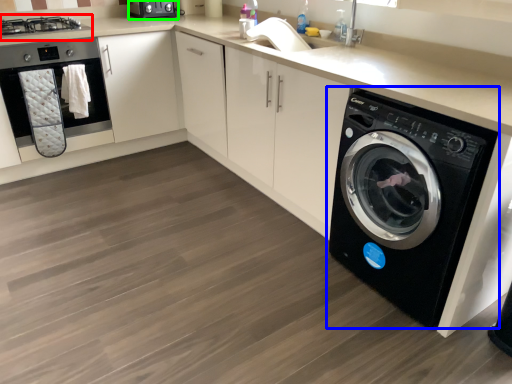
Question: Estimate the real-world distances between objects in this image. Which object is farther from stove (highlighted by a red box), washing machine (highlighted by a blue box) or appliance (highlighted by a green box)?

Choices:
 (A) washing machine
 (B) appliance

Answer: (A)